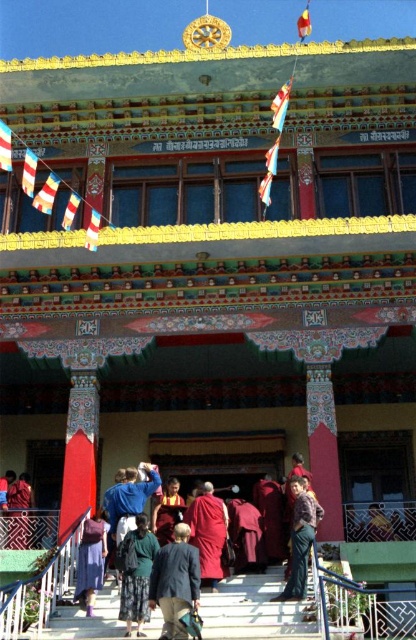
Is green fabric skirt at center shorter than maroon woolen robe at center?

Incorrect, green fabric skirt at center's height does not fall short of maroon woolen robe at center's.

Which is behind, point (126, 557) or point (218, 515)?

Point (218, 515)

Locate an element on the screen. This screenshot has width=416, height=640. green fabric skirt at center is located at coordinates (136, 573).

Identify the location of red velvet robe at lower left. (19, 513).

The image size is (416, 640). What do you see at coordinates (19, 513) in the screenshot?
I see `red velvet robe at lower left` at bounding box center [19, 513].

Does point (20, 481) lie in front of point (304, 16)?

Yes, it is in front of point (304, 16).

Where is `red velvet robe at lower left`? red velvet robe at lower left is located at coordinates (19, 513).

Can you confirm if striped fabric flag at left is thinner than red fabric flag at upper center?

Yes.

Is striped fabric flag at left to the right of red fabric flag at upper center from the viewer's perspective?

In fact, striped fabric flag at left is to the left of red fabric flag at upper center.

Is point (42, 196) farther from camera compared to point (306, 10)?

No, it is not.

At what (x,y) coordinates should I click in order to perform the action: click on striped fabric flag at left. Please return your answer as a coordinate pair (x, y). Looking at the image, I should click on (47, 195).